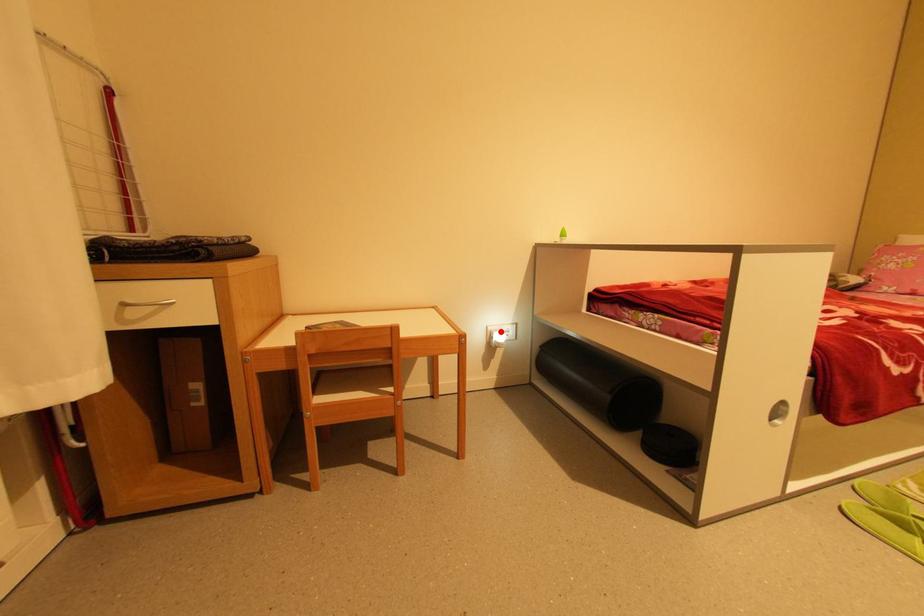
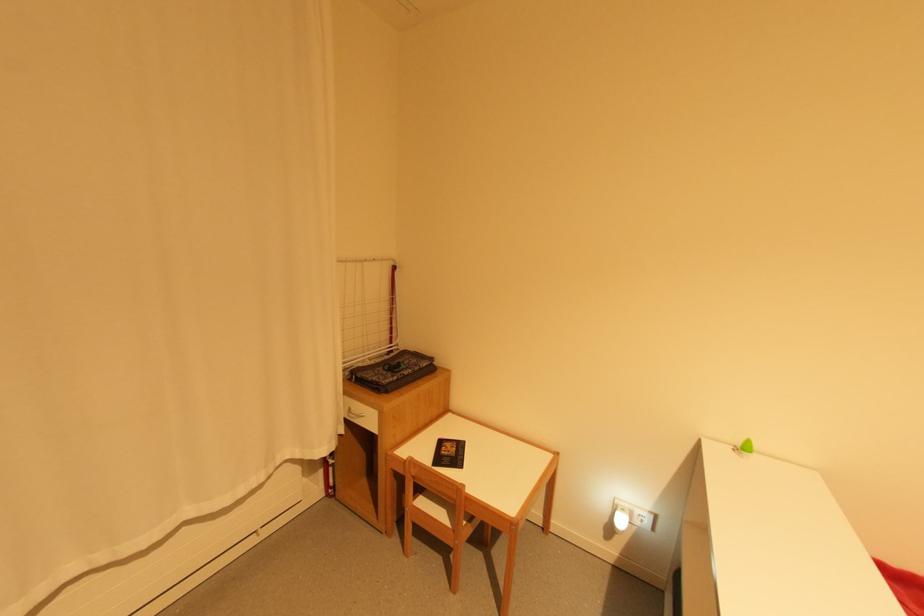
Locate, in the second image, the point that corresponds to the highlighted location in the first image.

(627, 511)